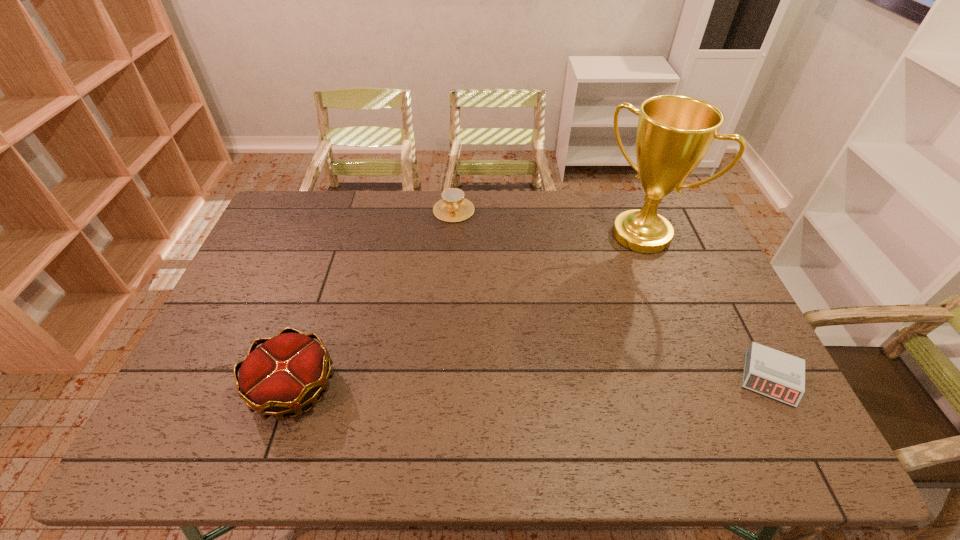
The width and height of the screenshot is (960, 540). Identify the location of vacant space on the desktop that is between the crown and the shortest object and is positioned by the handles of the award. (525, 383).

Identify the location of free spot on the desktop that is between the crown and the alarm clock and is positioned with the handle on the side of the third object from right to left. (510, 383).